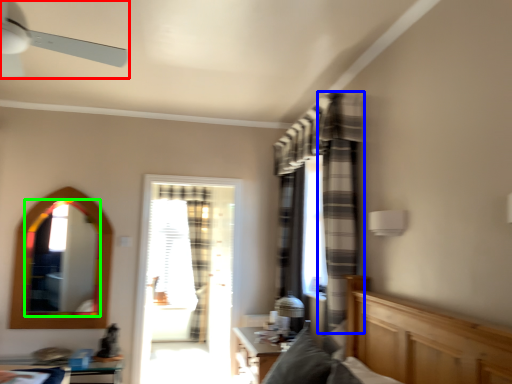
Question: Which object is positioned farthest from ceiling fan (highlighted by a red box)? Select from curtain (highlighted by a blue box) and mirror (highlighted by a green box).

Choices:
 (A) curtain
 (B) mirror

Answer: (B)